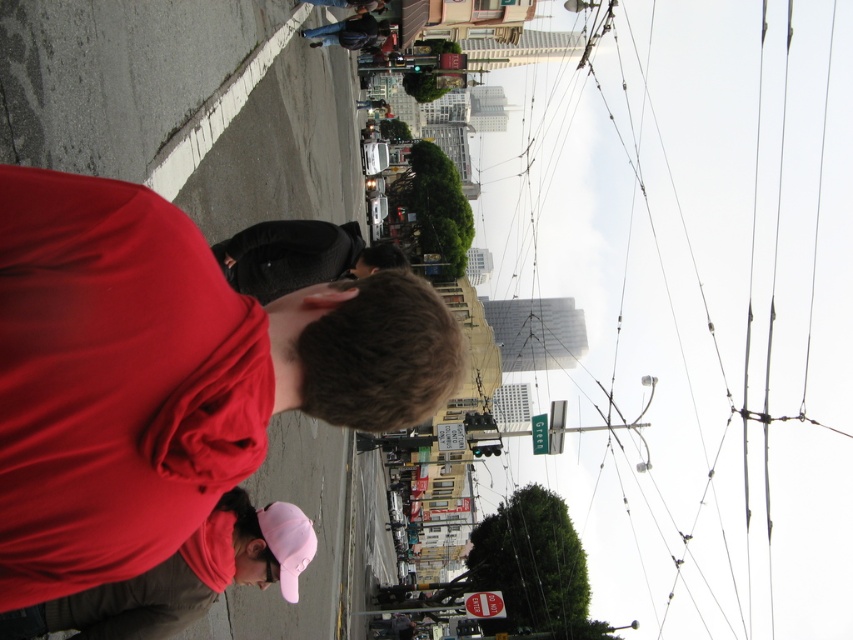
You are a photographer standing in the street and see the matte red shirt at center and the black fabric hat at center. Which object is higher up in the scene?

The matte red shirt at center is much taller than the black fabric hat at center, so the matte red shirt at center is higher up in the scene.

Where is the matte red shirt at center located in the image?

The matte red shirt at center is located at point (167, 376) in the image.